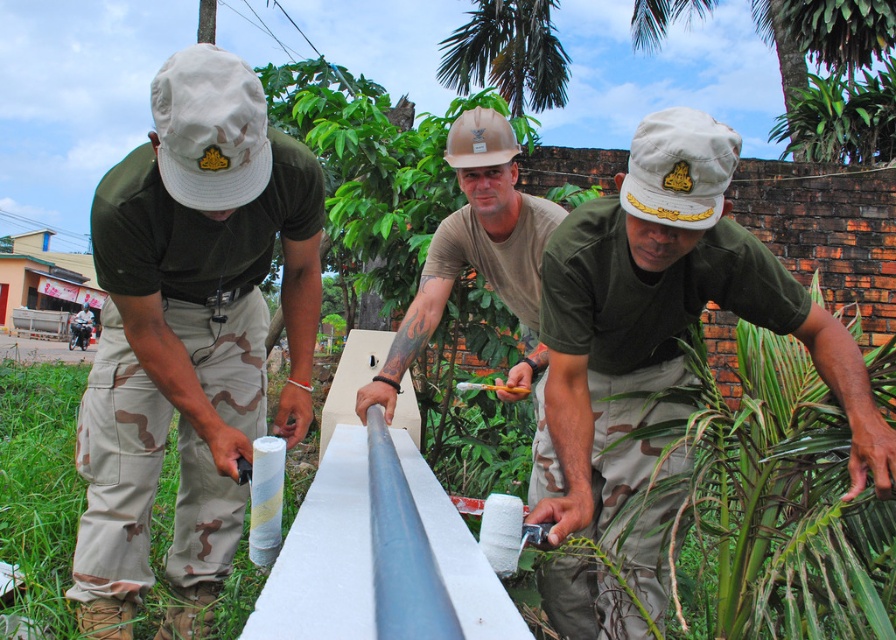
Is green matte uniform at center bigger than matte brown helmet at center?

Indeed, green matte uniform at center has a larger size compared to matte brown helmet at center.

Who is taller, green matte uniform at center or matte brown helmet at center?

Standing taller between the two is green matte uniform at center.

The image size is (896, 640). I want to click on green matte uniform at center, so click(664, 321).

This screenshot has height=640, width=896. Identify the location of green matte uniform at center. point(664,321).

Can you confirm if matte khaki uniform at center is positioned to the left of green matte uniform at center?

Correct, you'll find matte khaki uniform at center to the left of green matte uniform at center.

Between matte khaki uniform at center and green matte uniform at center, which one has less height?

green matte uniform at center

At what (x,y) coordinates should I click in order to perform the action: click on matte khaki uniform at center. Please return your answer as a coordinate pair (x, y). Looking at the image, I should click on (190, 336).

Measure the distance from matte khaki uniform at center to matte brown helmet at center.

They are 26.95 inches apart.

Is point (308, 256) positioned behind point (362, 410)?

No.

The image size is (896, 640). In order to click on matte khaki uniform at center in this screenshot , I will do `click(190, 336)`.